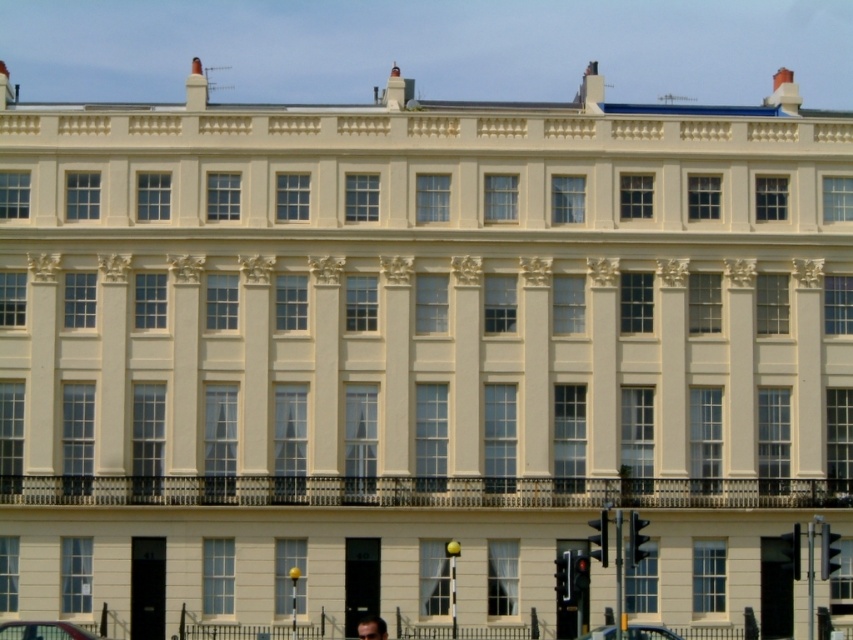
Is point (16, 620) behind point (360, 618)?

No, (16, 620) is closer to viewer.

Is metallic silver car at lower center further to camera compared to dark brown hair at lower center?

That is True.

This screenshot has width=853, height=640. What do you see at coordinates (44, 630) in the screenshot?
I see `metallic silver car at lower center` at bounding box center [44, 630].

The image size is (853, 640). What are the coordinates of `metallic silver car at lower center` in the screenshot? It's located at (44, 630).

Who is taller, metallic silver car at center or dark brown hair at lower center?

dark brown hair at lower center

Is point (592, 634) positioned behind point (374, 634)?

Yes.

Where is `metallic silver car at center`? This screenshot has height=640, width=853. metallic silver car at center is located at coordinates (648, 632).

Consider the image. Between metallic silver car at lower center and metallic silver car at center, which one is positioned higher?

metallic silver car at lower center

Can you confirm if metallic silver car at lower center is smaller than metallic silver car at center?

Indeed, metallic silver car at lower center has a smaller size compared to metallic silver car at center.

Which is in front, point (38, 636) or point (654, 632)?

Positioned in front is point (38, 636).

The image size is (853, 640). I want to click on metallic silver car at lower center, so click(x=44, y=630).